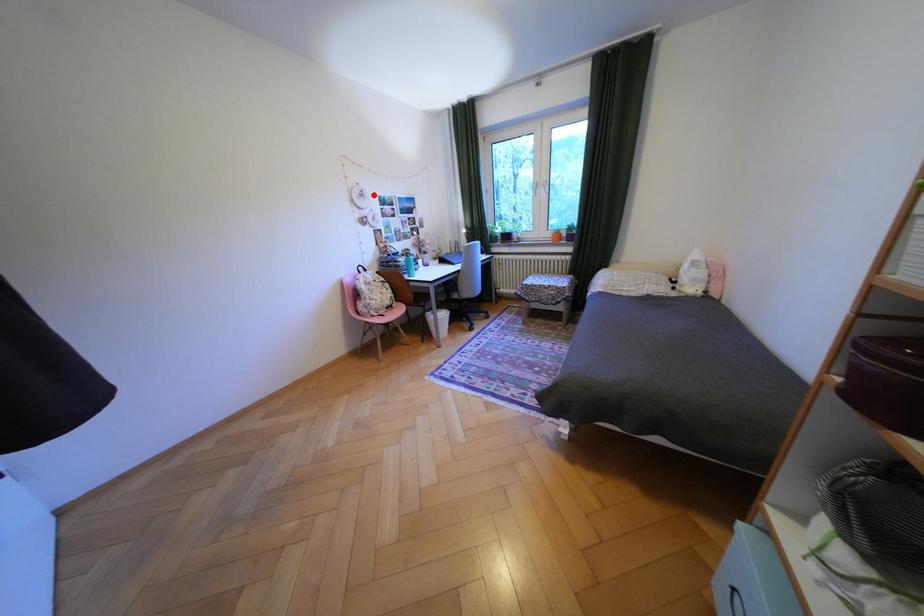
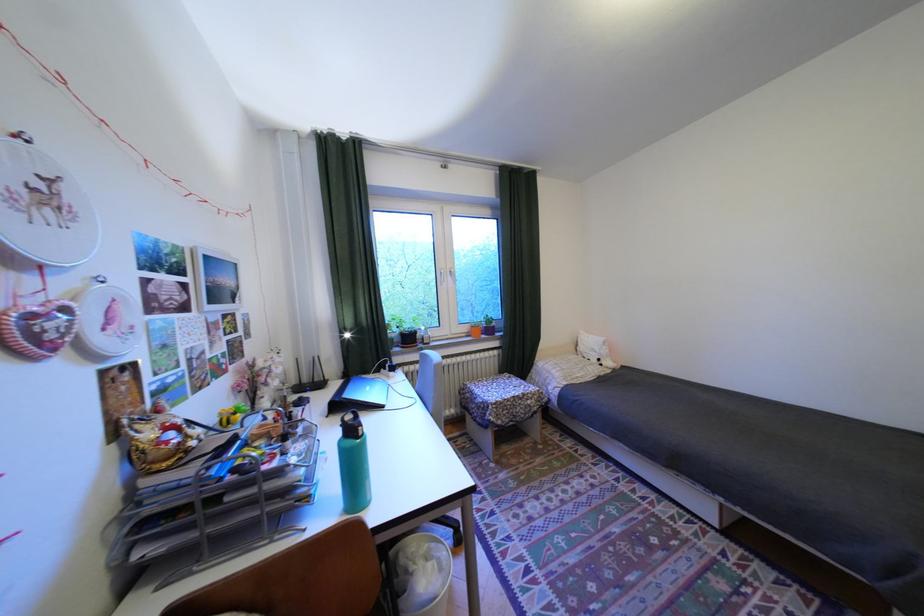
In the second image, find the point that corresponds to the highlighted location in the first image.

(58, 197)